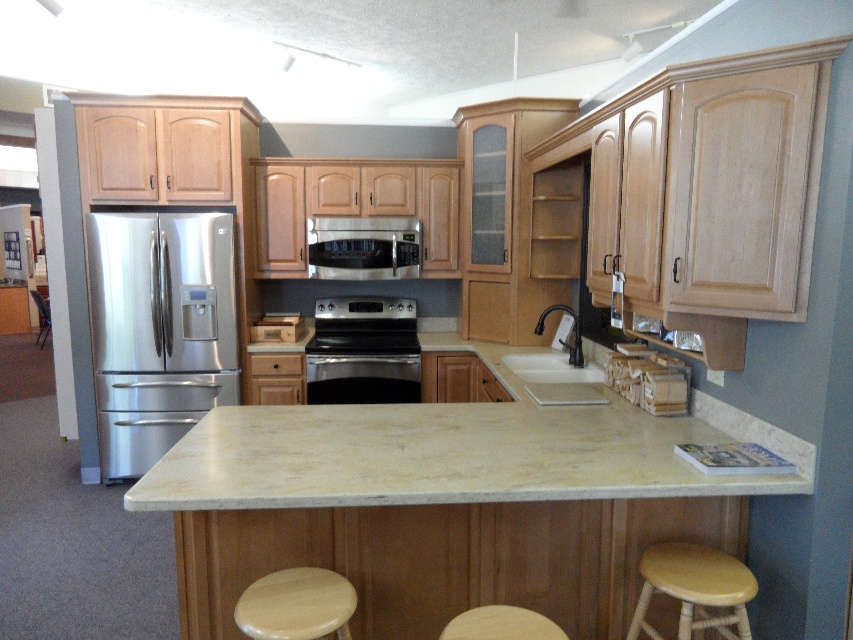
Image resolution: width=853 pixels, height=640 pixels. Describe the element at coordinates (296, 604) in the screenshot. I see `light brown wood stool at lower center` at that location.

Is light brown wood stool at lower center closer to the viewer compared to stainless steel microwave at center?

Yes, light brown wood stool at lower center is closer to the viewer.

Is point (343, 602) positioned before point (419, 225)?

Yes, point (343, 602) is in front of point (419, 225).

Identify the location of light brown wood stool at lower center. This screenshot has width=853, height=640. click(x=296, y=604).

Who is lower down, light brown wood stool at lower center or light wood bar stool at lower center?

Positioned lower is light brown wood stool at lower center.

Consider the image. Between light brown wood stool at lower center and light wood bar stool at lower center, which one is positioned higher?

light wood bar stool at lower center

Who is more distant from viewer, (265, 605) or (537, 612)?

Positioned behind is point (537, 612).

I want to click on light brown wood stool at lower center, so click(296, 604).

Which of these two, black stainless steel oven at center or light wood/wooden stool at lower right, stands shorter?

light wood/wooden stool at lower right is shorter.

Is black stainless steel oven at center wider than light wood/wooden stool at lower right?

Yes.

Where is `black stainless steel oven at center`? This screenshot has height=640, width=853. black stainless steel oven at center is located at coordinates pyautogui.click(x=363, y=349).